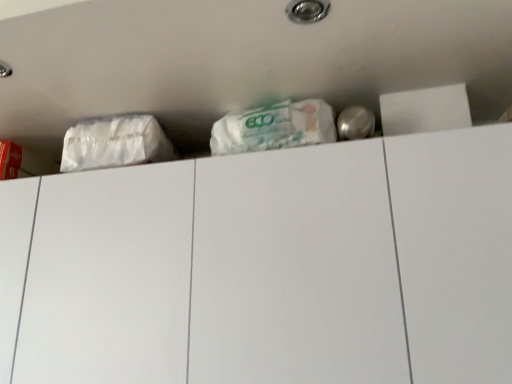
Question: Should I look upward or downward to see white matte drawer at upper center?

Choices:
 (A) up
 (B) down

Answer: (B)

Question: Would you say white matte plastic bag at upper left is part of white matte drawer at upper center's contents?

Choices:
 (A) no
 (B) yes

Answer: (A)

Question: Does white matte drawer at upper center appear on the right side of white matte plastic bag at upper left?

Choices:
 (A) yes
 (B) no

Answer: (A)

Question: Does white matte drawer at upper center turn towards white matte plastic bag at upper left?

Choices:
 (A) yes
 (B) no

Answer: (B)

Question: Can you confirm if white matte drawer at upper center is taller than white matte plastic bag at upper left?

Choices:
 (A) yes
 (B) no

Answer: (A)

Question: Can you confirm if white matte drawer at upper center is smaller than white matte plastic bag at upper left?

Choices:
 (A) yes
 (B) no

Answer: (B)

Question: Is white matte drawer at upper center looking in the opposite direction of white matte plastic bag at upper left?

Choices:
 (A) no
 (B) yes

Answer: (A)

Question: Could you tell me if white matte plastic bag at upper left is turned towards white matte drawer at upper center?

Choices:
 (A) no
 (B) yes

Answer: (A)

Question: Considering the relative sizes of white matte plastic bag at upper left and white matte drawer at upper center in the image provided, is white matte plastic bag at upper left smaller than white matte drawer at upper center?

Choices:
 (A) no
 (B) yes

Answer: (B)

Question: Is white matte plastic bag at upper left wider than white matte drawer at upper center?

Choices:
 (A) no
 (B) yes

Answer: (A)

Question: Does white matte plastic bag at upper left appear on the right side of white matte drawer at upper center?

Choices:
 (A) no
 (B) yes

Answer: (A)

Question: Is white matte plastic bag at upper left closer to the viewer compared to white matte drawer at upper center?

Choices:
 (A) no
 (B) yes

Answer: (A)

Question: Is white matte plastic bag at upper left bigger than white matte drawer at upper center?

Choices:
 (A) no
 (B) yes

Answer: (A)

Question: Considering the positions of white matte drawer at upper center and white matte plastic bag at upper left in the image, is white matte drawer at upper center taller or shorter than white matte plastic bag at upper left?

Choices:
 (A) short
 (B) tall

Answer: (B)